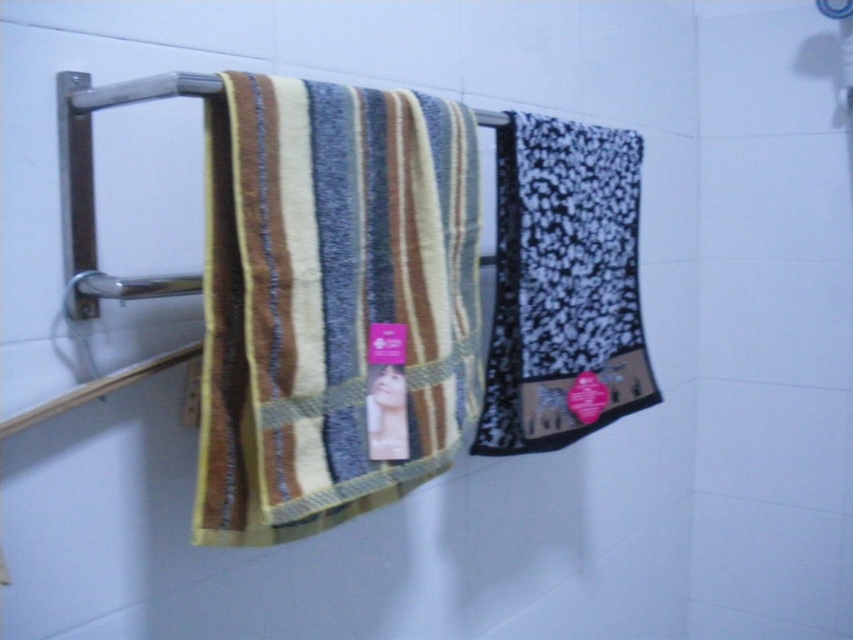
From the picture: Does multicolored woven towel at center lie in front of black textured towel at right?

Yes, multicolored woven towel at center is in front of black textured towel at right.

Who is more distant from viewer, (355, 456) or (627, 332)?

The point (627, 332) is behind.

Locate an element on the screen. The image size is (853, 640). multicolored woven towel at center is located at coordinates (332, 301).